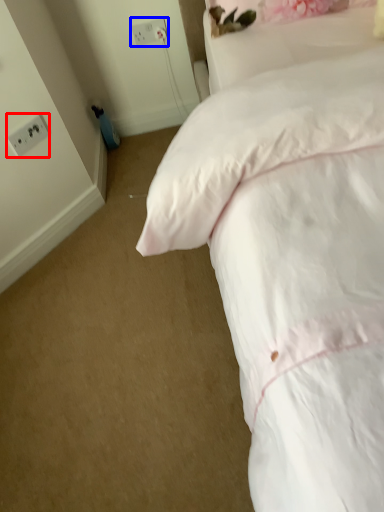
Question: Among these objects, which one is nearest to the camera, electric outlet (highlighted by a red box) or electric outlet (highlighted by a blue box)?

Choices:
 (A) electric outlet
 (B) electric outlet

Answer: (A)